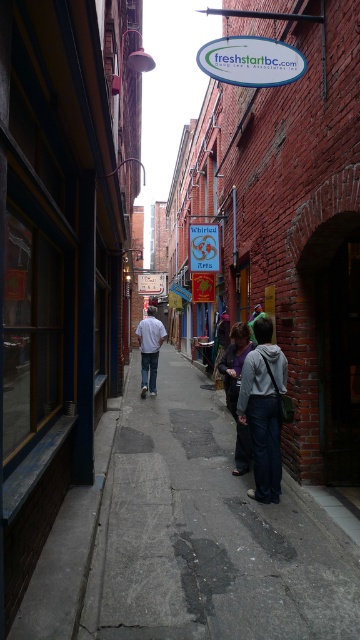
You are a delivery person trying to navigate through the narrow alleyway. You see a gray fabric jacket at center and a white cotton shirt at center. Which clothing item is located to the right when facing the alley?

The gray fabric jacket at center is positioned on the right side of white cotton shirt at center, so it is located to the right when facing the alley.

You are a delivery person carrying a package and need to place it on the ground in the alley. The package is heavy and must be placed on a stable surface. Based on the scene, can you confirm if the concrete sidewalk at center is a suitable surface to place the dark gray hoodie at center on?

The concrete sidewalk at center is below the dark gray hoodie at center, indicating that the hoodie is resting on the sidewalk. Since the sidewalk is a stable surface, it is suitable to place the dark gray hoodie at center there.

You are standing in the alleyway and want to determine the distance between two points marked as point (230, 396) and point (141, 396). If you move from the closer point to the farther point, which direction should you face?

Since point (230, 396) is closer to the viewer than point (141, 396), you should move towards the direction away from the viewer to reach the farther point. Therefore, you should face away from the viewer when moving from the closer point to the farther point.